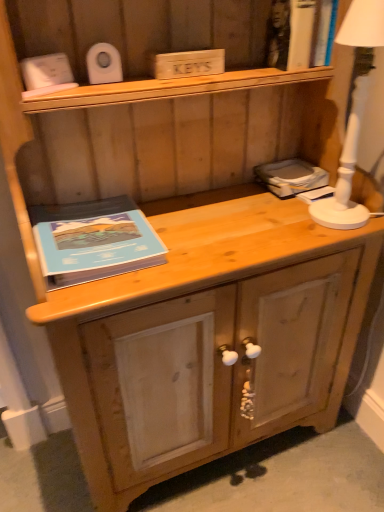
At what (x,y) coordinates should I click in order to perform the action: click on natural wood drawer at lower center. Please return your answer as a coordinate pair (x, y). The image size is (384, 512). Looking at the image, I should click on (217, 366).

You are a GUI agent. You are given a task and a screenshot of the screen. Output one action in this format:
    pyautogui.click(x=<x>, y=<y>)
    Task: Click on the white ceramic lamp at right
    
    Given the screenshot: What is the action you would take?
    pyautogui.click(x=353, y=114)

Locate an element on the screen. The image size is (384, 512). natural wood drawer at lower center is located at coordinates (217, 366).

Is blue matte book at left facing towards white ceramic lamp at right?

No, blue matte book at left is not oriented towards white ceramic lamp at right.

Between blue matte book at left and white ceramic lamp at right, which one appears on the right side from the viewer's perspective?

Positioned to the right is white ceramic lamp at right.

Does blue matte book at left touch white ceramic lamp at right?

No, blue matte book at left is not beside white ceramic lamp at right.

Can white ceramic lamp at right be found inside blue matte book at left?

No.

Considering the points (146, 251) and (192, 335), which point is in front, point (146, 251) or point (192, 335)?

Point (146, 251)

Based on the photo, is blue matte book at left beside natural wood drawer at lower center?

No.

Is the depth of blue matte book at left greater than that of natural wood drawer at lower center?

No, the depth of blue matte book at left is less than that of natural wood drawer at lower center.

From the image's perspective, which object appears higher, blue matte book at left or natural wood drawer at lower center?

blue matte book at left is shown above in the image.

In terms of height, does white ceramic lamp at right look taller or shorter compared to matte gray book at right?

In the image, white ceramic lamp at right appears to be taller than matte gray book at right.

Considering the relative sizes of white ceramic lamp at right and matte gray book at right in the image provided, is white ceramic lamp at right smaller than matte gray book at right?

No, white ceramic lamp at right is not smaller than matte gray book at right.

Which of these two, white ceramic lamp at right or matte gray book at right, is thinner?

Thinner between the two is white ceramic lamp at right.

In the scene shown: In terms of width, does natural wood drawer at lower center look wider or thinner when compared to white ceramic lamp at right?

In the image, natural wood drawer at lower center appears to be wider than white ceramic lamp at right.

What's the angular difference between natural wood drawer at lower center and white ceramic lamp at right's facing directions?

A: natural wood drawer at lower center and white ceramic lamp at right are facing 91.3 degrees away from each other.

Locate an element on the screen. bedside lamp that is on the right side of natural wood drawer at lower center is located at coordinates (353, 114).

Considering the relative positions of natural wood drawer at lower center and white ceramic lamp at right in the image provided, is natural wood drawer at lower center to the right of white ceramic lamp at right from the viewer's perspective?

No.

Which object is wider, white ceramic lamp at right or blue matte book at left?

blue matte book at left.

From the image's perspective, does white ceramic lamp at right appear higher than blue matte book at left?

Yes, from the image's perspective, white ceramic lamp at right is over blue matte book at left.

Is white ceramic lamp at right shorter than blue matte book at left?

No, white ceramic lamp at right is not shorter than blue matte book at left.

I want to click on book on the right of blue matte book at left, so click(x=291, y=177).

Is matte gray book at right taller than blue matte book at left?

Correct, matte gray book at right is much taller as blue matte book at left.

Based on the photo, from a real-world perspective, is matte gray book at right located beneath blue matte book at left?

No, from a real-world perspective, matte gray book at right is not below blue matte book at left.

Is matte gray book at right located outside blue matte book at left?

Yes, matte gray book at right is not within blue matte book at left.

Would you consider natural wood drawer at lower center to be distant from blue matte book at left?

Actually, natural wood drawer at lower center and blue matte book at left are a little close together.

From the image's perspective, would you say natural wood drawer at lower center is shown under blue matte book at left?

Yes, from the image's perspective, natural wood drawer at lower center is below blue matte book at left.

Between natural wood drawer at lower center and blue matte book at left, which one has larger width?

natural wood drawer at lower center is wider.

Which object is further away from the camera taking this photo, natural wood drawer at lower center or blue matte book at left?

natural wood drawer at lower center is more distant.

Where is `bedside lamp above the blue matte book at left (from a real-world perspective)`? bedside lamp above the blue matte book at left (from a real-world perspective) is located at coordinates (353, 114).

Identify the location of drawer located underneath the blue matte book at left (from a real-world perspective). (217, 366).

From the picture: Looking at the image, which one is located closer to blue matte book at left, white ceramic lamp at right or natural wood drawer at lower center?

natural wood drawer at lower center is positioned closer to the anchor blue matte book at left.

From the image, which object appears to be nearer to matte gray book at right, natural wood drawer at lower center or white ceramic lamp at right?

The object closer to matte gray book at right is white ceramic lamp at right.

When comparing their distances from white ceramic lamp at right, does natural wood drawer at lower center or blue matte book at left seem further?

blue matte book at left lies further to white ceramic lamp at right than the other object.

Looking at the image, which one is located further to white ceramic lamp at right, natural wood drawer at lower center or matte gray book at right?

Based on the image, natural wood drawer at lower center appears to be further to white ceramic lamp at right.

Looking at the image, which one is located further to blue matte book at left, natural wood drawer at lower center or matte gray book at right?

matte gray book at right.

Estimate the real-world distances between objects in this image. Which object is further from blue matte book at left, natural wood drawer at lower center or white ceramic lamp at right?

white ceramic lamp at right lies further to blue matte book at left than the other object.

When comparing their distances from matte gray book at right, does natural wood drawer at lower center or blue matte book at left seem closer?

The object closer to matte gray book at right is natural wood drawer at lower center.

Which object lies further to the anchor point matte gray book at right, blue matte book at left or natural wood drawer at lower center?

blue matte book at left lies further to matte gray book at right than the other object.

Where is `book between blue matte book at left and white ceramic lamp at right from left to right`? book between blue matte book at left and white ceramic lamp at right from left to right is located at coordinates (291, 177).

Locate an element on the screen. book between white ceramic lamp at right and natural wood drawer at lower center vertically is located at coordinates (291, 177).

You are a GUI agent. You are given a task and a screenshot of the screen. Output one action in this format:
    pyautogui.click(x=<x>, y=<y>)
    Task: Click on the paperback book between matte gray book at right and natural wood drawer at lower center vertically
    The image size is (384, 512).
    Given the screenshot: What is the action you would take?
    pyautogui.click(x=93, y=240)

The width and height of the screenshot is (384, 512). I want to click on paperback book between white ceramic lamp at right and natural wood drawer at lower center in the vertical direction, so click(93, 240).